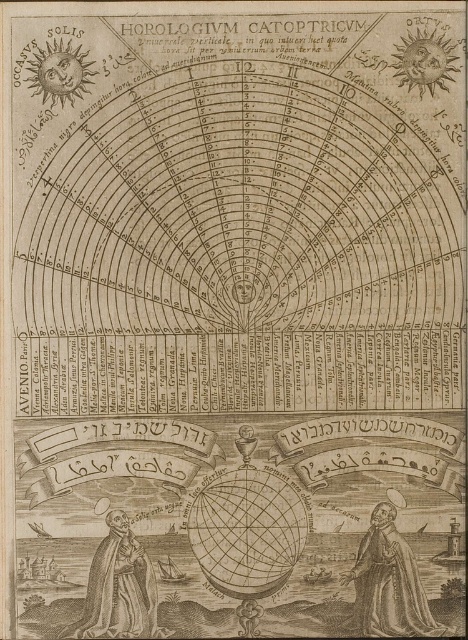
You are an astronomer examining the chart and need to adjust your telescope to focus on the central sun depiction. To do so, you must first move either the smooth brown robe at lower right or the wooden statue at lower left. Which object should you move to ensure an unobstructed view of the central sun?

The wooden statue at lower left is behind the smooth brown robe at lower right, so you should move the smooth brown robe at lower right to ensure an unobstructed view of the central sun.

You are an astronomer examining the chart and need to place a smooth brown robe at lower right and a wooden statue at lower left on a shelf. The shelf has limited space. Which object will take up less horizontal space on the shelf?

The smooth brown robe at lower right is thinner than the wooden statue at lower left, so it will take up less horizontal space on the shelf.

You are an astronomer examining the astronomical chart and need to determine the spatial relationship between two points marked on the diagram. Which point is closer to the observer, point at position (363, 596) or point at position (141, 564)?

Point at position (141, 564) is closer to the observer because the description states that point at position (363, 596) is behind point at position (141, 564).